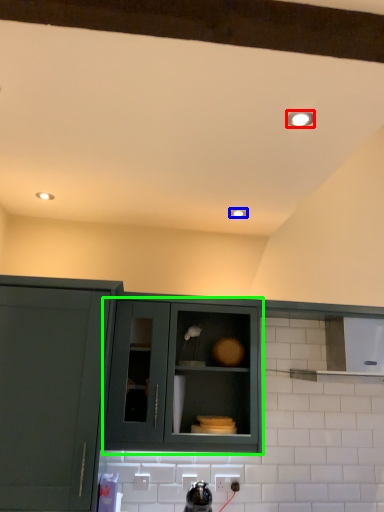
Question: Which object is the farthest from light fixture (highlighted by a red box)? Choose among these: lighting (highlighted by a blue box) or cabinetry (highlighted by a green box).

Choices:
 (A) lighting
 (B) cabinetry

Answer: (B)